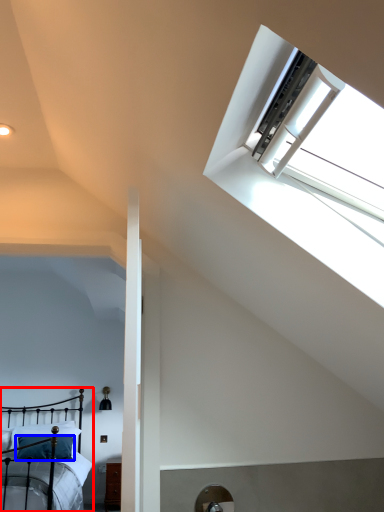
Question: Which object appears farthest to the camera in this image, bed (highlighted by a red box) or pillow (highlighted by a blue box)?

Choices:
 (A) bed
 (B) pillow

Answer: (B)